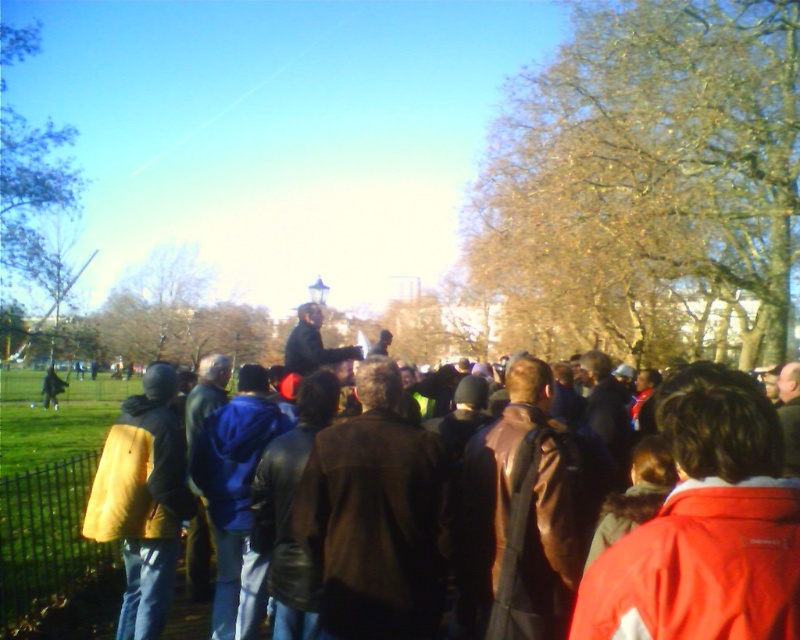
Which of these two, red jacket at center or brown leather jacket at center, stands shorter?

brown leather jacket at center

The image size is (800, 640). I want to click on red jacket at center, so click(705, 528).

Between yellow leather jacket at left and green leafy tree at upper left, which one appears on the right side from the viewer's perspective?

Positioned to the right is yellow leather jacket at left.

Does yellow leather jacket at left have a lesser height compared to green leafy tree at upper left?

Indeed, yellow leather jacket at left has a lesser height compared to green leafy tree at upper left.

Between point (162, 538) and point (48, 193), which one is positioned in front?

Positioned in front is point (162, 538).

The width and height of the screenshot is (800, 640). Identify the location of yellow leather jacket at left. (144, 499).

Is red jacket at center bigger than green leafy tree at upper left?

Incorrect, red jacket at center is not larger than green leafy tree at upper left.

Between red jacket at center and green leafy tree at upper left, which one appears on the left side from the viewer's perspective?

green leafy tree at upper left

Identify the location of red jacket at center. This screenshot has width=800, height=640. (705, 528).